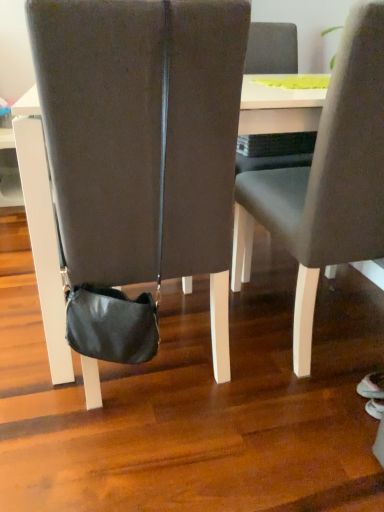
Question: Can you confirm if white glossy table at center is taller than black leather bag at center, arranged as the first chair when viewed from the left?

Choices:
 (A) yes
 (B) no

Answer: (B)

Question: Is white glossy table at center not within black leather bag at center, arranged as the first chair when viewed from the left?

Choices:
 (A) no
 (B) yes

Answer: (B)

Question: Does white glossy table at center contain black leather bag at center, the second chair in the right-to-left sequence?

Choices:
 (A) no
 (B) yes

Answer: (B)

Question: Does white glossy table at center have a larger size compared to black leather bag at center, arranged as the first chair when viewed from the left?

Choices:
 (A) yes
 (B) no

Answer: (A)

Question: From a real-world perspective, is white glossy table at center located beneath black leather bag at center, the second chair in the right-to-left sequence?

Choices:
 (A) no
 (B) yes

Answer: (B)

Question: Is white glossy table at center next to black leather bag at center, the second chair in the right-to-left sequence, and touching it?

Choices:
 (A) yes
 (B) no

Answer: (B)

Question: Is matte gray chair at center, the second chair positioned from the left, at the right side of white glossy table at center?

Choices:
 (A) yes
 (B) no

Answer: (A)

Question: Does matte gray chair at center, the first chair from the right, appear on the left side of white glossy table at center?

Choices:
 (A) no
 (B) yes

Answer: (A)

Question: Would you say white glossy table at center is part of matte gray chair at center, the second chair positioned from the left,'s contents?

Choices:
 (A) no
 (B) yes

Answer: (A)

Question: Does matte gray chair at center, the first chair from the right, lie in front of white glossy table at center?

Choices:
 (A) no
 (B) yes

Answer: (B)

Question: Does matte gray chair at center, the second chair positioned from the left, have a larger size compared to white glossy table at center?

Choices:
 (A) yes
 (B) no

Answer: (B)

Question: Does matte gray chair at center, the second chair positioned from the left, have a greater height compared to white glossy table at center?

Choices:
 (A) yes
 (B) no

Answer: (A)

Question: Can you confirm if matte gray chair at center, the first chair from the right, is shorter than black leather bag at center, the second chair in the right-to-left sequence?

Choices:
 (A) no
 (B) yes

Answer: (A)